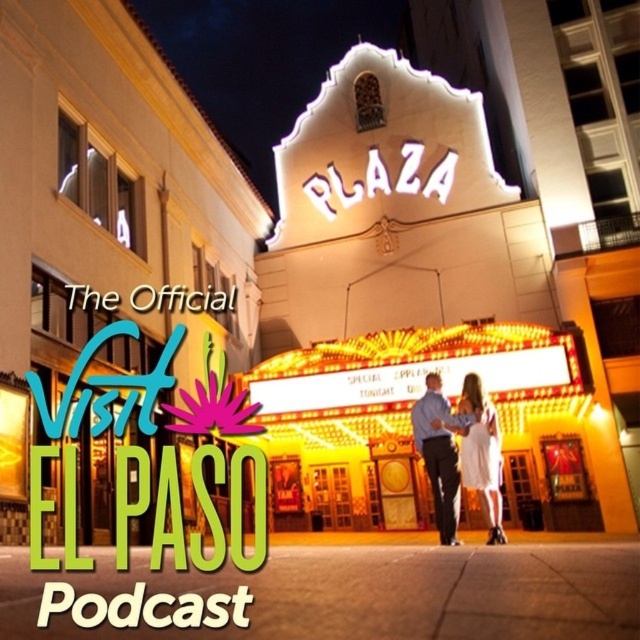
Question: Which object appears farthest from the camera in this image?

Choices:
 (A) white satin dress at center
 (B) blue shirt at center
 (C) yellow neon sign at center

Answer: (C)

Question: Is blue shirt at center positioned in front of white satin dress at center?

Choices:
 (A) yes
 (B) no

Answer: (A)

Question: Based on their relative distances, which object is farther from the blue shirt at center?

Choices:
 (A) yellow neon sign at center
 (B) white satin dress at center

Answer: (A)

Question: Which point is farther to the camera?

Choices:
 (A) (435, 419)
 (B) (483, 412)

Answer: (A)

Question: Can you confirm if blue shirt at center is positioned to the right of white satin dress at center?

Choices:
 (A) no
 (B) yes

Answer: (A)

Question: Is yellow neon sign at center positioned at the back of white satin dress at center?

Choices:
 (A) yes
 (B) no

Answer: (A)